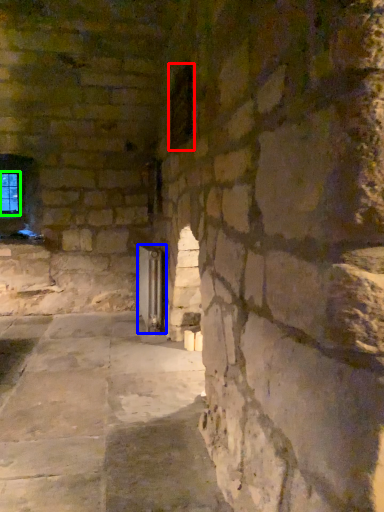
Question: Considering the real-world distances, which object is closest to window (highlighted by a red box)? glass door (highlighted by a blue box) or window (highlighted by a green box).

Choices:
 (A) glass door
 (B) window

Answer: (A)